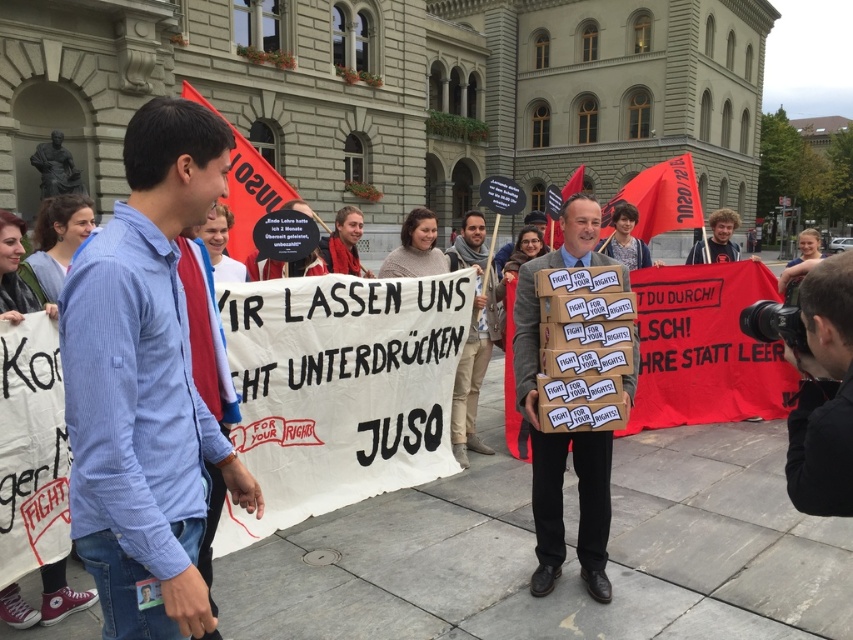
Who is lower down, blue shirt at left or brown leather jacket at center?

blue shirt at left is below.

Is blue shirt at left taller than brown leather jacket at center?

No.

Which is in front, point (96, 442) or point (447, 250)?

Point (96, 442)

Find the location of a particular element. This screenshot has height=640, width=853. blue shirt at left is located at coordinates (146, 385).

Who is lower down, red fabric flag at upper left or red fabric flag at center?

red fabric flag at upper left

Is red fabric flag at upper left thinner than red fabric flag at center?

Yes, red fabric flag at upper left is thinner than red fabric flag at center.

Is point (234, 253) closer to viewer compared to point (570, 180)?

Yes, point (234, 253) is in front of point (570, 180).

Identify the location of red fabric flag at upper left. The width and height of the screenshot is (853, 640). (250, 193).

Does cardboard boxes at center have a larger size compared to matte black camera at right?

Indeed, cardboard boxes at center has a larger size compared to matte black camera at right.

Which of these two, cardboard boxes at center or matte black camera at right, stands shorter?

Standing shorter between the two is matte black camera at right.

Does point (556, 554) lie behind point (838, 272)?

Yes, it is behind point (838, 272).

You are a GUI agent. You are given a task and a screenshot of the screen. Output one action in this format:
    pyautogui.click(x=<x>, y=<y>)
    Task: Click on the cardboard boxes at center
    The height and width of the screenshot is (640, 853).
    Given the screenshot: What is the action you would take?
    pyautogui.click(x=561, y=433)